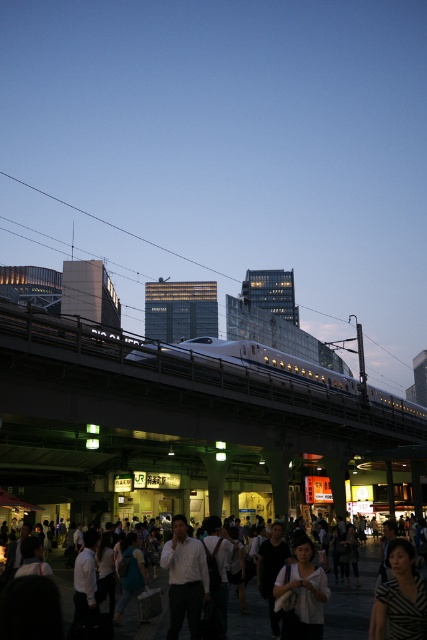
You are a photographer standing on the elevated train track and want to take a photo of the two people below. The white matte shirt at lower center and the white shirt at center are both in your view. If your camera has a minimum focus distance of 10 meters, can you focus on both subjects clearly?

The white matte shirt at lower center is 10.23 meters from white shirt at center. Since the distance between them is just over 10 meters, the camera can focus on both subjects as the minimum focus distance is met.

You are a photographer standing in the pedestrian area below the elevated train tracks. You want to capture a photo of the metallic silver train at center and the white shirt at center in the same frame. Given that your camera has a maximum focus range of 80 feet, will you be able to include both objects in your shot?

The metallic silver train at center and the white shirt at center are 78.08 feet apart from each other. Since the distance between them is within the camera maximum focus range of 80 feet, you can include both objects in the same frame.